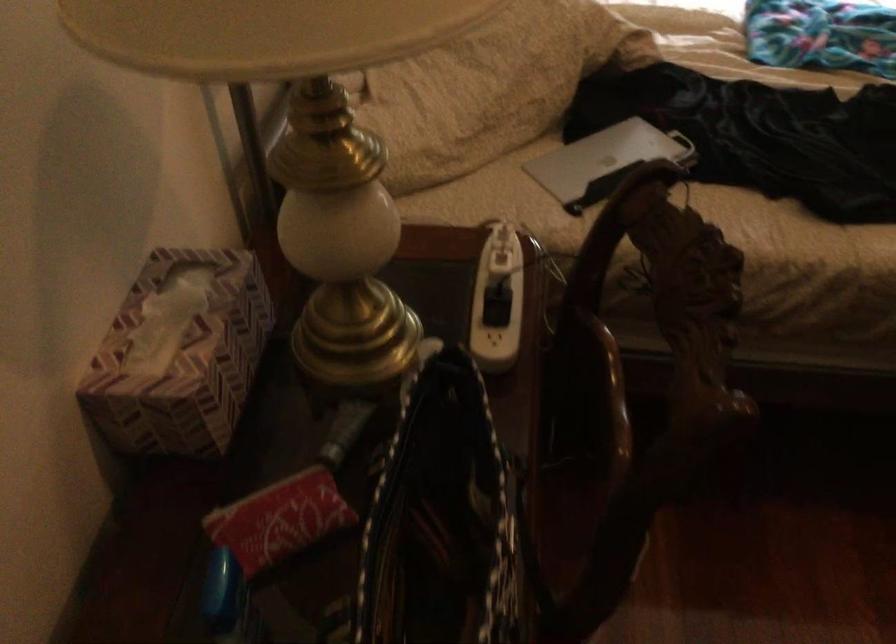
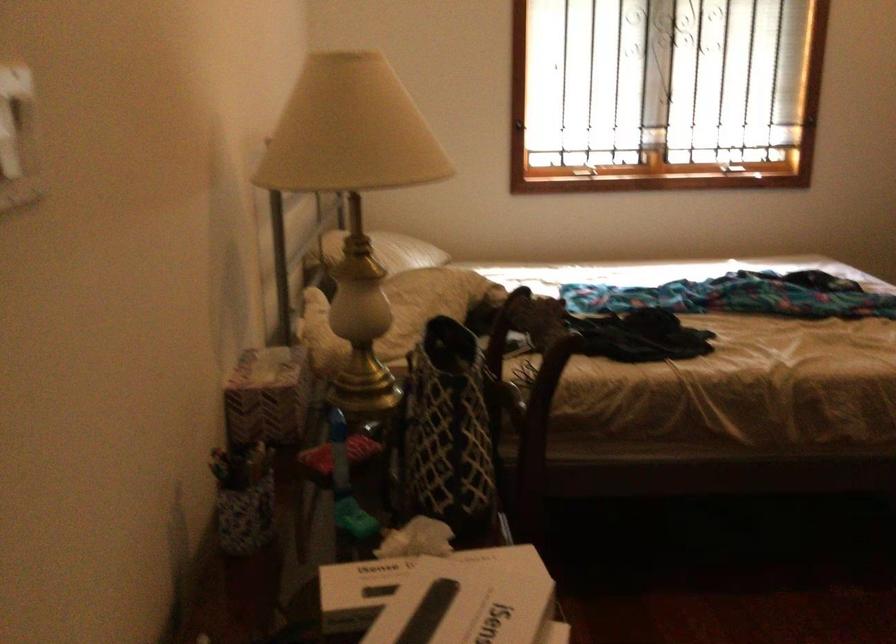
Question: The images are taken continuously from a first-person perspective. In which direction is your viewpoint rotating?

Choices:
 (A) Left
 (B) Right
 (C) Up
 (D) Down

Answer: (C)